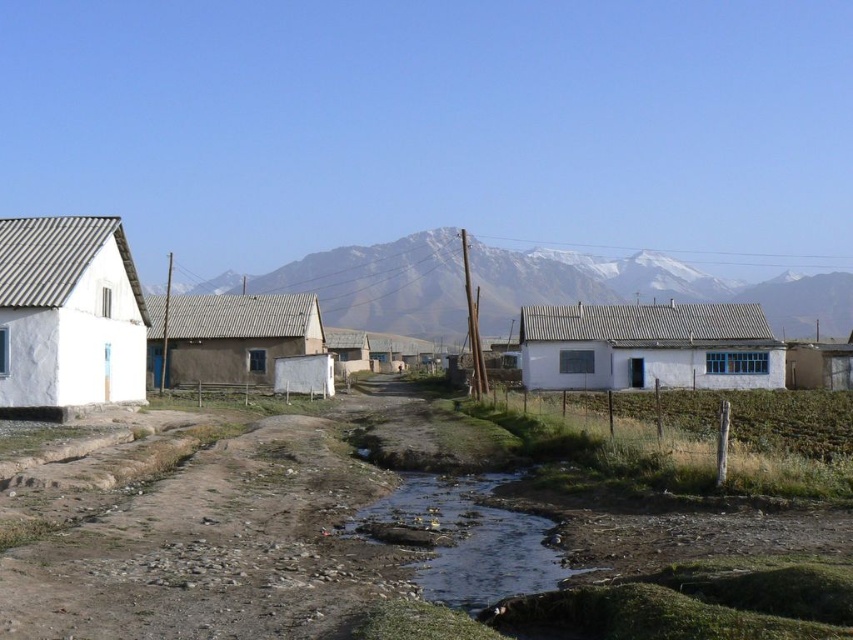
You are planning to build a fence that is 10 meters long along the brown muddy stream at center. The white stucco house at left is nearby. Can the fence be built without overlapping the house?

The white stucco house at left might be wider than brown muddy stream at center, so there is a possibility that the fence could overlap with the house. Further measurements are needed to confirm.

You are a delivery person with a cart that is 2 meters wide. You need to move from the brown gravel dirt track at lower center to the brown muddy stream at center. Is there enough space between them to maneuver your cart?

The brown gravel dirt track at lower center and brown muddy stream at center are 2.16 meters apart. Since your cart is 2 meters wide, there is enough space to maneuver between them as the distance is slightly larger than the cart width.

What is the 2D coordinate of the brown gravel dirt track at lower center in the image?

The brown gravel dirt track at lower center is located at the 2D coordinate point of (210, 548).